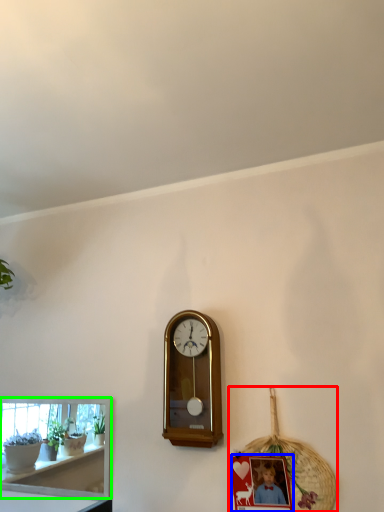
Question: Based on their relative distances, which object is farther from basket (highlighted by a red box)? Choose from picture frame (highlighted by a blue box) and shelf (highlighted by a green box).

Choices:
 (A) picture frame
 (B) shelf

Answer: (B)